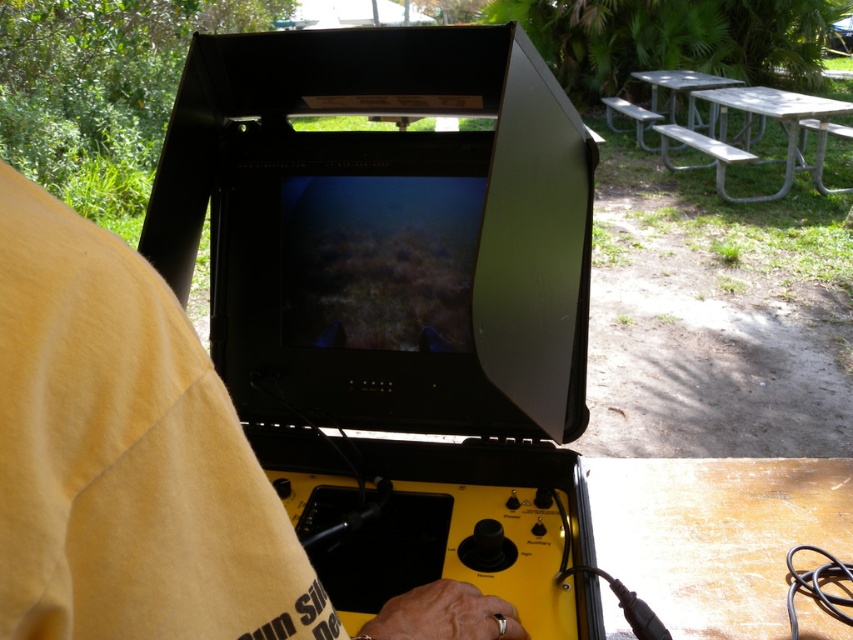
You are a technician trying to locate the yellow cotton shirt at center in the image. According to the coordinates provided, where exactly is the yellow cotton shirt positioned?

The yellow cotton shirt at center is located at point coordinates of 0.713 on the x axis and 0.148 on the y axis.

You are standing in the same position as the person in the image. Which object, the yellow cotton shirt at center or the silver metallic picnic table at upper right, would appear larger to you?

The yellow cotton shirt at center appears larger because it is closer to the viewer than the silver metallic picnic table at upper right.

You are standing in the scene and want to place a small tool on the nearest object. Which object should you choose between the yellow cotton shirt at center and the wooden picnic table at lower right?

The yellow cotton shirt at center is closer to the viewer than the wooden picnic table at lower right, so you should place the small tool on the yellow cotton shirt at center.